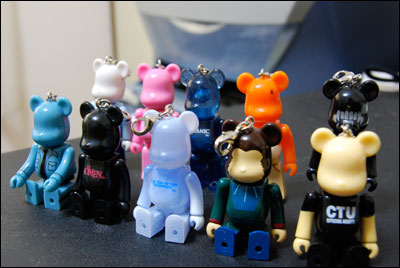
The height and width of the screenshot is (268, 400). What are the coordinates of `grey counter top` in the screenshot? It's located at (77, 259).